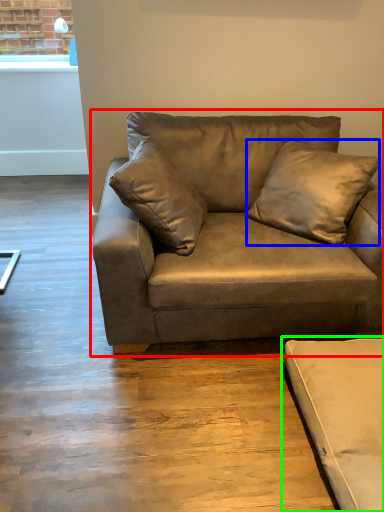
Question: Based on their relative distances, which object is farther from studio couch (highlighted by a red box)? Choose from pillow (highlighted by a blue box) and studio couch (highlighted by a green box).

Choices:
 (A) pillow
 (B) studio couch

Answer: (B)